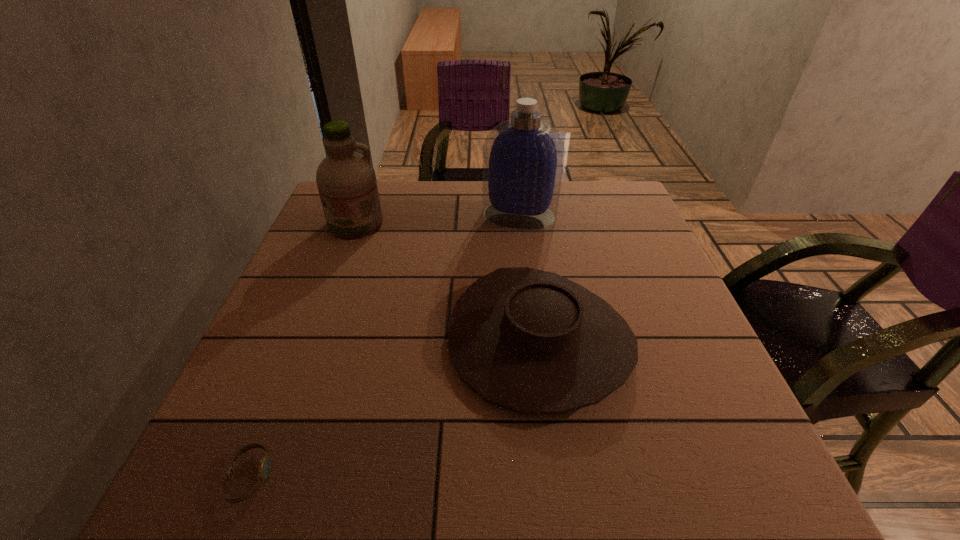
Identify the location of the right cleansing agent. This screenshot has height=540, width=960. (523, 158).

The image size is (960, 540). In order to click on the left cleansing agent in this screenshot , I will do `click(346, 180)`.

Locate an element on the screen. The height and width of the screenshot is (540, 960). the second nearest object is located at coordinates (531, 341).

At what (x,y) coordinates should I click in order to perform the action: click on the third tallest object. Please return your answer as a coordinate pair (x, y). The height and width of the screenshot is (540, 960). Looking at the image, I should click on (531, 341).

Find the location of a particular element. the shortest object is located at coordinates (264, 467).

Identify the location of watch. (264, 467).

In order to click on vacant space situated on the front of the right cleansing agent in this screenshot , I will do `click(532, 318)`.

Identify the location of free region located 0.070m on the front label of the left cleansing agent. (344, 258).

Locate an element on the screen. free space located on the back of the cowboy hat is located at coordinates (523, 214).

Locate an element on the screen. The image size is (960, 540). vacant space located on the face of the nearest object is located at coordinates (308, 477).